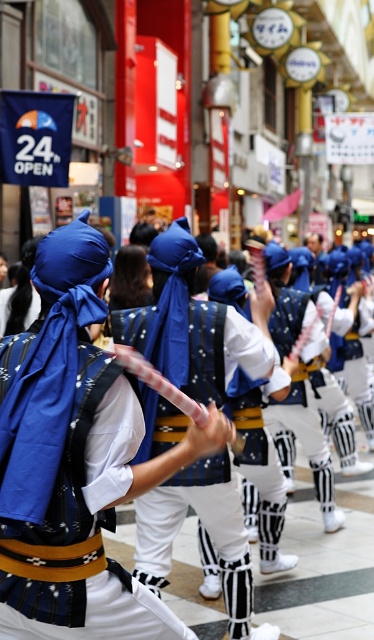
Who is positioned more to the left, matte blue headscarf at center or blue fabric mask at center?

matte blue headscarf at center is more to the left.

Can you confirm if matte blue headscarf at center is shorter than blue fabric mask at center?

Yes.

Between point (78, 314) and point (218, 506), which one is positioned behind?

The point (218, 506) is behind.

Locate an element on the screen. The image size is (374, 640). matte blue headscarf at center is located at coordinates (75, 460).

Can you confirm if blue fabric mask at center is positioned below white matte uniform at center?

Yes, blue fabric mask at center is below white matte uniform at center.

Does point (184, 426) come farther from viewer compared to point (311, 371)?

No, (184, 426) is closer to viewer.

Identify the location of blue fabric mask at center. Image resolution: width=374 pixels, height=640 pixels. (204, 528).

Looking at this image, does matte blue headscarf at center have a larger size compared to white matte uniform at center?

Incorrect, matte blue headscarf at center is not larger than white matte uniform at center.

Who is positioned more to the left, matte blue headscarf at center or white matte uniform at center?

matte blue headscarf at center

Is point (90, 468) farther from camera compared to point (308, 416)?

No, (90, 468) is in front of (308, 416).

Identify the location of matte blue headscarf at center. (75, 460).